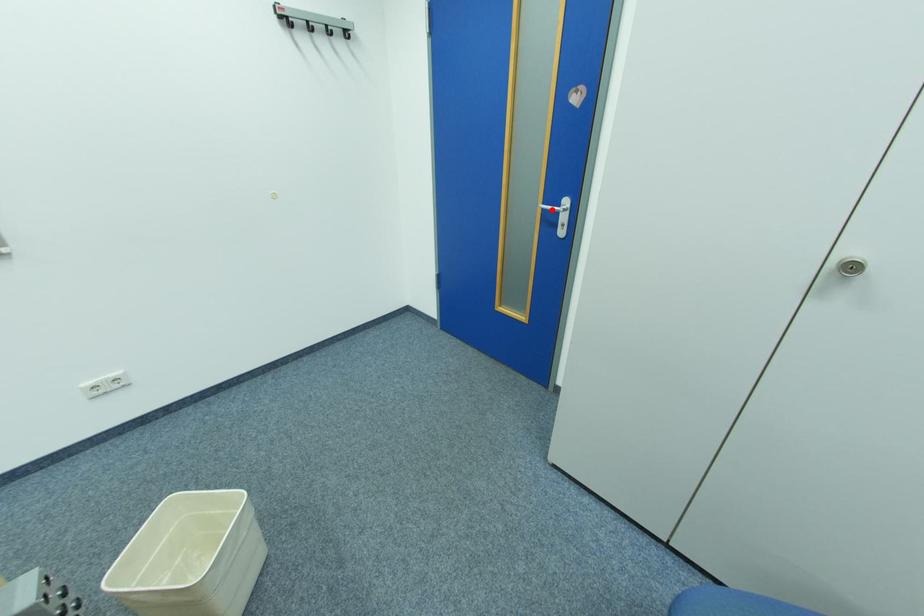
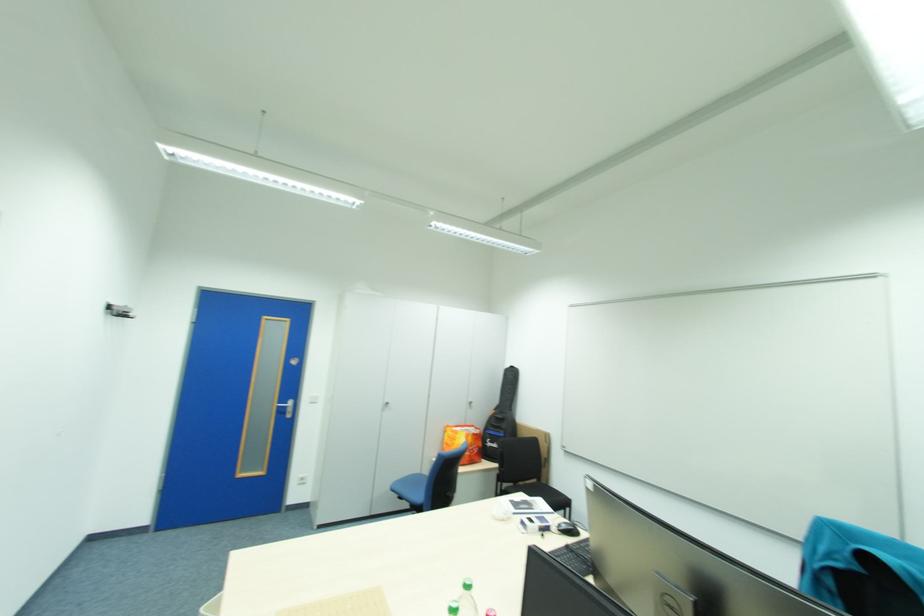
Where in the second image is the point corresponding to the highlighted location from the first image?

(286, 407)